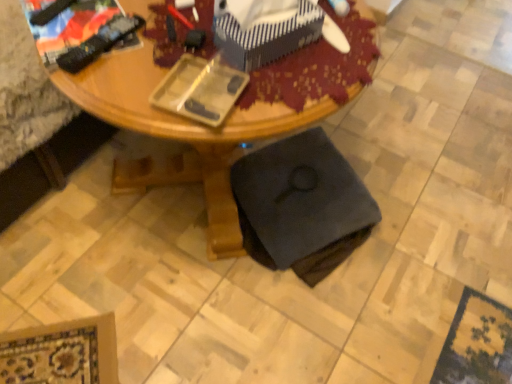
Question: From the image's perspective, is black fabric swivel chair at lower center located above wooden desk at center?

Choices:
 (A) yes
 (B) no

Answer: (B)

Question: Considering the relative sizes of black fabric swivel chair at lower center and wooden desk at center in the image provided, is black fabric swivel chair at lower center wider than wooden desk at center?

Choices:
 (A) yes
 (B) no

Answer: (B)

Question: Is black fabric swivel chair at lower center bigger than wooden desk at center?

Choices:
 (A) yes
 (B) no

Answer: (B)

Question: From the image's perspective, is black fabric swivel chair at lower center under wooden desk at center?

Choices:
 (A) no
 (B) yes

Answer: (B)

Question: Does black fabric swivel chair at lower center contain wooden desk at center?

Choices:
 (A) yes
 (B) no

Answer: (B)

Question: Considering the positions of wooden desk at center and blue striped fabric box at upper center in the image, is wooden desk at center bigger or smaller than blue striped fabric box at upper center?

Choices:
 (A) big
 (B) small

Answer: (A)

Question: Visually, is wooden desk at center positioned to the left or to the right of blue striped fabric box at upper center?

Choices:
 (A) right
 (B) left

Answer: (B)

Question: Considering the positions of wooden desk at center and blue striped fabric box at upper center in the image, is wooden desk at center wider or thinner than blue striped fabric box at upper center?

Choices:
 (A) thin
 (B) wide

Answer: (B)

Question: Considering the positions of point (216, 193) and point (252, 3), is point (216, 193) closer or farther from the camera than point (252, 3)?

Choices:
 (A) farther
 (B) closer

Answer: (A)

Question: Based on their sizes in the image, would you say blue striped fabric box at upper center is bigger or smaller than black fabric swivel chair at lower center?

Choices:
 (A) big
 (B) small

Answer: (B)

Question: Is blue striped fabric box at upper center in front of or behind black fabric swivel chair at lower center in the image?

Choices:
 (A) front
 (B) behind

Answer: (A)

Question: In terms of width, does blue striped fabric box at upper center look wider or thinner when compared to black fabric swivel chair at lower center?

Choices:
 (A) thin
 (B) wide

Answer: (A)

Question: In the image, is blue striped fabric box at upper center on the left side or the right side of black fabric swivel chair at lower center?

Choices:
 (A) left
 (B) right

Answer: (A)

Question: From the image's perspective, is black fabric swivel chair at lower center located above or below blue striped fabric box at upper center?

Choices:
 (A) below
 (B) above

Answer: (A)

Question: In terms of height, does black fabric swivel chair at lower center look taller or shorter compared to blue striped fabric box at upper center?

Choices:
 (A) short
 (B) tall

Answer: (B)